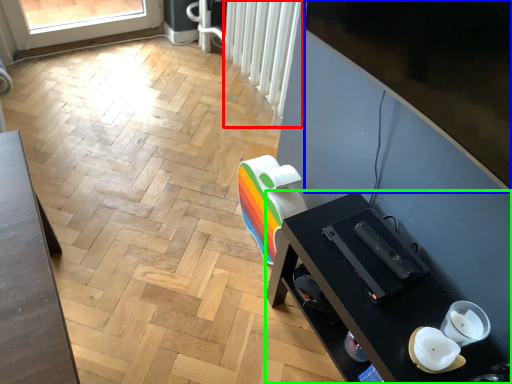
Question: Based on their relative distances, which object is nearer to radiator (highlighted by a red box)? Choose from window screen (highlighted by a blue box) and desk (highlighted by a green box).

Choices:
 (A) window screen
 (B) desk

Answer: (A)